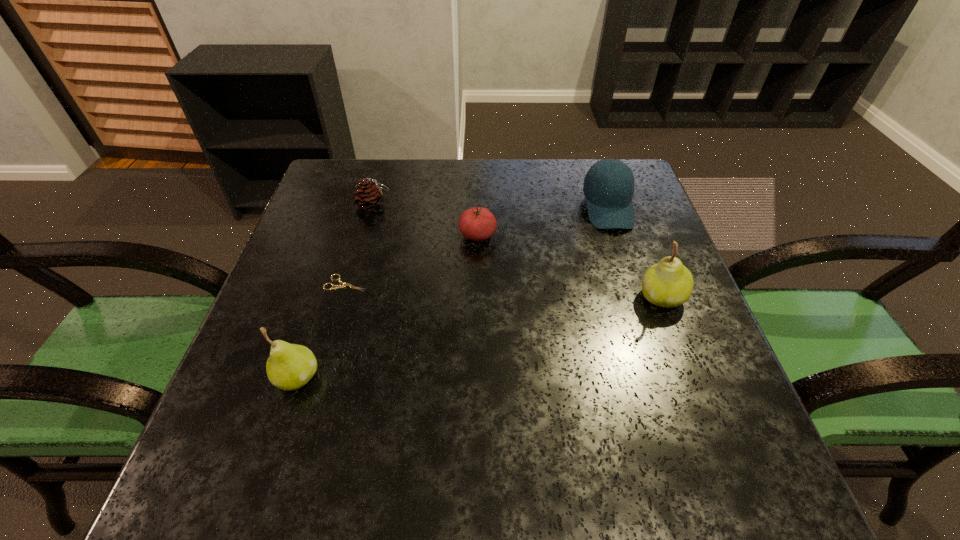
The width and height of the screenshot is (960, 540). What are the coordinates of `vacant space located with a leaf charm attached to the pinecone` in the screenshot? It's located at (467, 206).

You are a GUI agent. You are given a task and a screenshot of the screen. Output one action in this format:
    pyautogui.click(x=<x>, y=<y>)
    Task: Click on the vacant space located on the right of the third object from right to left
    
    Given the screenshot: What is the action you would take?
    pyautogui.click(x=554, y=236)

This screenshot has height=540, width=960. In order to click on free region located 0.370m on the front-facing side of the third tallest object in this screenshot , I will do `click(659, 362)`.

This screenshot has height=540, width=960. Find the location of `free region located on the right of the shears`. free region located on the right of the shears is located at coordinates (432, 283).

Where is `pinecone at the far edge`? This screenshot has height=540, width=960. pinecone at the far edge is located at coordinates (369, 196).

Locate an element on the screen. The image size is (960, 540). baseball cap located in the far edge section of the desktop is located at coordinates (608, 187).

Where is `object that is positioned at the near edge`? This screenshot has width=960, height=540. object that is positioned at the near edge is located at coordinates pos(290,366).

At what (x,y) coordinates should I click in order to perform the action: click on pear that is at the left edge. Please return your answer as a coordinate pair (x, y). This screenshot has width=960, height=540. Looking at the image, I should click on (290, 366).

The width and height of the screenshot is (960, 540). Find the location of `pinecone that is at the left edge`. pinecone that is at the left edge is located at coordinates (369, 196).

You are a GUI agent. You are given a task and a screenshot of the screen. Output one action in this format:
    pyautogui.click(x=<x>, y=<y>)
    Task: Click on the shears that is positioned at the left edge
    Image resolution: width=960 pixels, height=540 pixels.
    Given the screenshot: What is the action you would take?
    pyautogui.click(x=343, y=285)